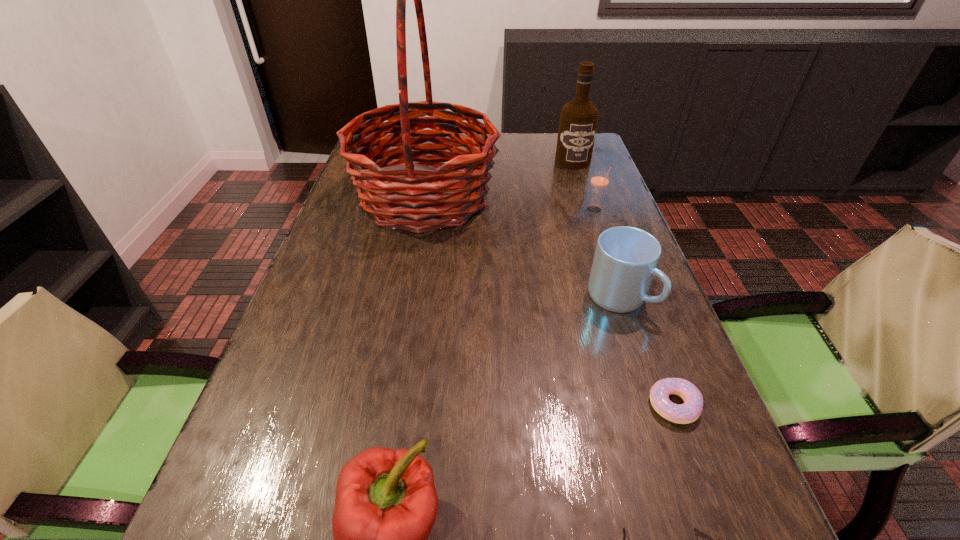
Where is `vacant area at the right edge of the desktop`? The width and height of the screenshot is (960, 540). vacant area at the right edge of the desktop is located at coordinates (588, 235).

The height and width of the screenshot is (540, 960). In order to click on free spot between the third nearest object and the fourth farthest object in this screenshot , I will do `click(646, 351)`.

Where is `object that is the fifth closest to the shortest object`? The image size is (960, 540). object that is the fifth closest to the shortest object is located at coordinates (599, 181).

Locate an element on the screen. This screenshot has width=960, height=540. object that stands as the closest to the doughnut is located at coordinates (625, 261).

This screenshot has width=960, height=540. What are the coordinates of `vacant region that satisfies the following two spatial constraints: 1. on the handle side of the basket; 2. on the back side of the third nearest object` in the screenshot? It's located at (390, 404).